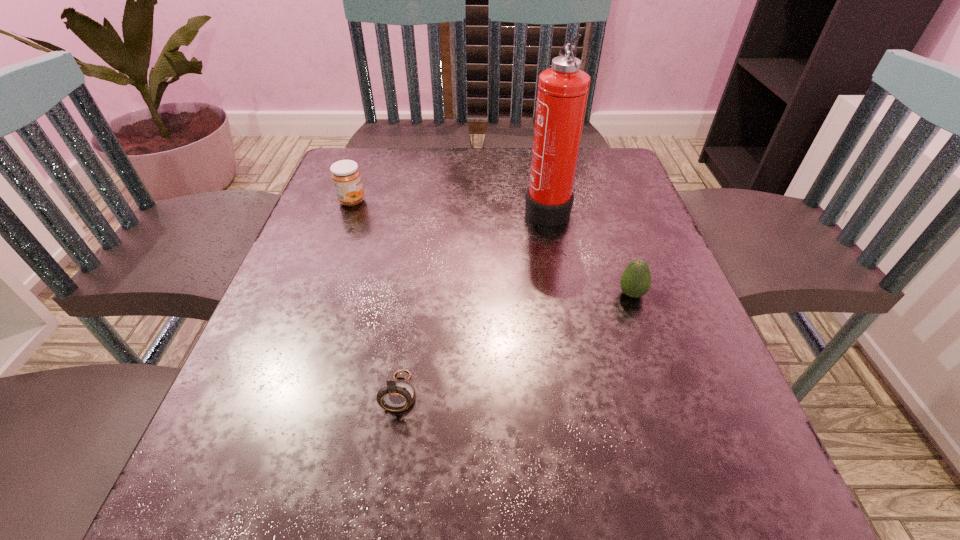
Identify the location of empty space between the jam and the avocado. (492, 248).

The height and width of the screenshot is (540, 960). I want to click on vacant region between the jam and the fire extinguisher, so click(449, 204).

This screenshot has height=540, width=960. In order to click on vacant space in between the second object from right to left and the third object from right to left in this screenshot , I will do `click(473, 300)`.

Identify the location of vacant point located between the rightmost object and the fire extinguisher. (589, 251).

Locate an element on the screen. object identified as the closest to the leftmost object is located at coordinates (563, 89).

Find the location of a particular element. This screenshot has height=540, width=960. the closest object to the avocado is located at coordinates (563, 89).

The height and width of the screenshot is (540, 960). Find the location of `blank area in the image that satisfies the following two spatial constraints: 1. on the front label of the leftmost object; 2. on the right side of the rightmost object`. blank area in the image that satisfies the following two spatial constraints: 1. on the front label of the leftmost object; 2. on the right side of the rightmost object is located at coordinates (318, 294).

You are a GUI agent. You are given a task and a screenshot of the screen. Output one action in this format:
    pyautogui.click(x=<x>, y=<y>)
    Task: Click on the vacant position in the image that satisfies the following two spatial constraints: 1. on the front-facing side of the rightmost object; 2. on the right side of the fire extinguisher
    
    Given the screenshot: What is the action you would take?
    pyautogui.click(x=563, y=294)

Find the location of a particular element. The width and height of the screenshot is (960, 540). free space that satisfies the following two spatial constraints: 1. on the back side of the avocado; 2. on the front label of the leftmost object is located at coordinates pos(599,201).